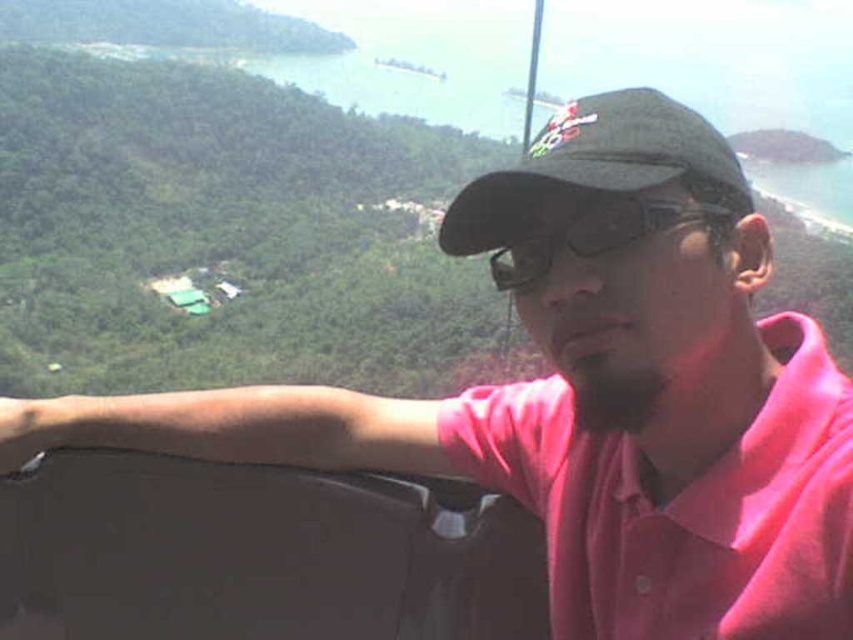
Question: Does pink cotton polo shirt at center lie in front of black fabric baseball cap at center?

Choices:
 (A) yes
 (B) no

Answer: (A)

Question: Among these objects, which one is farthest from the camera?

Choices:
 (A) pink cotton polo shirt at center
 (B) black fabric baseball cap at center

Answer: (B)

Question: From the image, what is the correct spatial relationship of pink cotton polo shirt at center in relation to black fabric baseball cap at center?

Choices:
 (A) left
 (B) right

Answer: (A)

Question: Is pink cotton polo shirt at center in front of black fabric baseball cap at center?

Choices:
 (A) no
 (B) yes

Answer: (B)